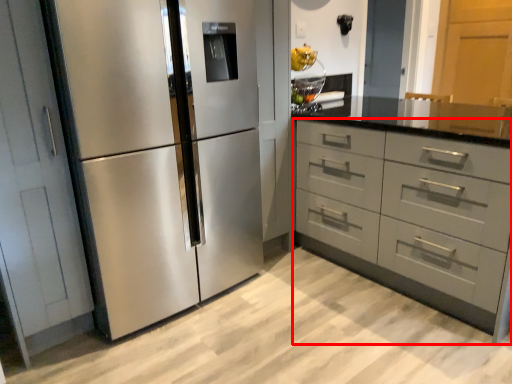
Question: In this image, where is chest of drawers (annotated by the red box) located relative to refrigerator?

Choices:
 (A) right
 (B) left

Answer: (A)